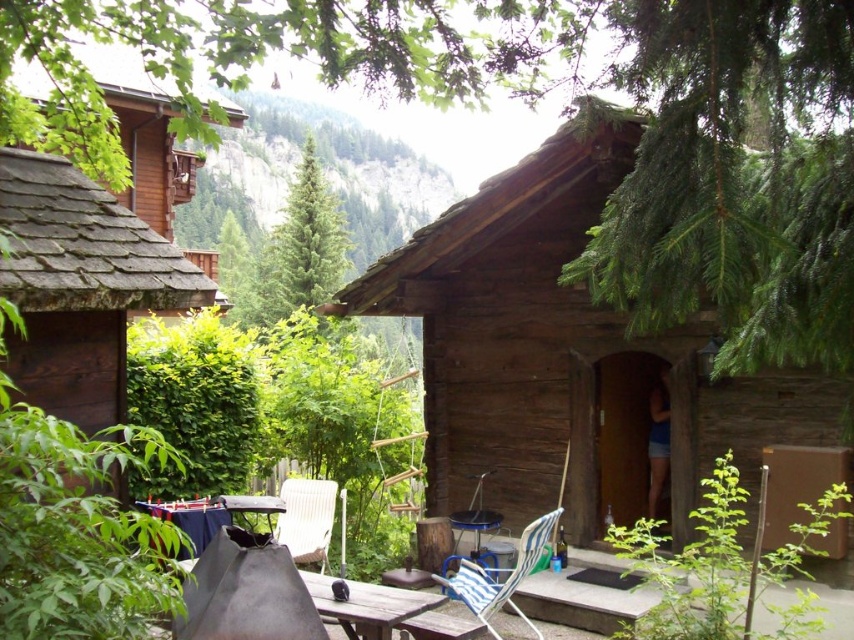
Question: Can you confirm if wooden cabin at left is smaller than white woven chair at center?

Choices:
 (A) no
 (B) yes

Answer: (A)

Question: Which of these objects is positioned farthest from the blue striped fabric chair at lower center?

Choices:
 (A) brown wooden cabin at center
 (B) wooden cabin at left

Answer: (B)

Question: Can you confirm if green coniferous tree at center is positioned to the right of white woven chair at center?

Choices:
 (A) no
 (B) yes

Answer: (A)

Question: Estimate the real-world distances between objects in this image. Which object is farther from the brown wooden table at lower center?

Choices:
 (A) brown wooden cabin at center
 (B) wooden picnic table at center

Answer: (A)

Question: Which of these objects is positioned closest to the wooden picnic table at center?

Choices:
 (A) green textured tree at upper center
 (B) wooden cabin at left

Answer: (B)

Question: Is green coniferous tree at center bigger than green textured tree at upper center?

Choices:
 (A) yes
 (B) no

Answer: (A)